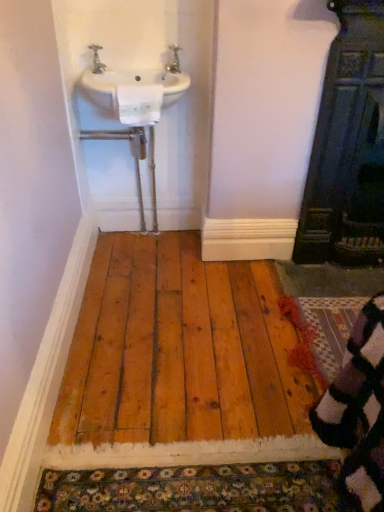
The height and width of the screenshot is (512, 384). I want to click on blank area to the left of silver metallic tap at upper center, which is counted as the second tap, starting from the left, so click(151, 68).